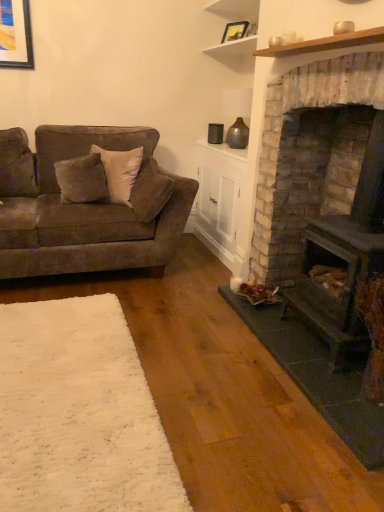
Question: Is the position of matte black picture frame at upper center more distant than that of white wood shelf at upper center?

Choices:
 (A) yes
 (B) no

Answer: (A)

Question: Does matte black picture frame at upper center have a smaller size compared to white wood shelf at upper center?

Choices:
 (A) yes
 (B) no

Answer: (A)

Question: Is the position of matte black picture frame at upper center less distant than that of white wood shelf at upper center?

Choices:
 (A) no
 (B) yes

Answer: (A)

Question: From a real-world perspective, is matte black picture frame at upper center beneath white wood shelf at upper center?

Choices:
 (A) no
 (B) yes

Answer: (B)

Question: Is matte black picture frame at upper center turned away from white wood shelf at upper center?

Choices:
 (A) yes
 (B) no

Answer: (A)

Question: Would you say velvet brown couch at left is to the left or to the right of white wood shelf at upper center in the picture?

Choices:
 (A) left
 (B) right

Answer: (A)

Question: Is velvet brown couch at left inside the boundaries of white wood shelf at upper center, or outside?

Choices:
 (A) outside
 (B) inside

Answer: (A)

Question: Is velvet brown couch at left wider or thinner than white wood shelf at upper center?

Choices:
 (A) thin
 (B) wide

Answer: (B)

Question: Based on their sizes in the image, would you say velvet brown couch at left is bigger or smaller than white wood shelf at upper center?

Choices:
 (A) small
 (B) big

Answer: (B)

Question: Choose the correct answer: Is matte black picture frame at upper center inside white soft rug at lower left or outside it?

Choices:
 (A) inside
 (B) outside

Answer: (B)

Question: Looking at the image, does matte black picture frame at upper center seem bigger or smaller compared to white soft rug at lower left?

Choices:
 (A) small
 (B) big

Answer: (A)

Question: Considering the positions of matte black picture frame at upper center and white soft rug at lower left in the image, is matte black picture frame at upper center wider or thinner than white soft rug at lower left?

Choices:
 (A) wide
 (B) thin

Answer: (B)

Question: From a real-world perspective, relative to white soft rug at lower left, is matte black picture frame at upper center vertically above or below?

Choices:
 (A) below
 (B) above

Answer: (B)

Question: Is velvet gray pillow at left wider or thinner than white soft rug at lower left?

Choices:
 (A) thin
 (B) wide

Answer: (A)

Question: Is velvet gray pillow at left taller or shorter than white soft rug at lower left?

Choices:
 (A) tall
 (B) short

Answer: (A)